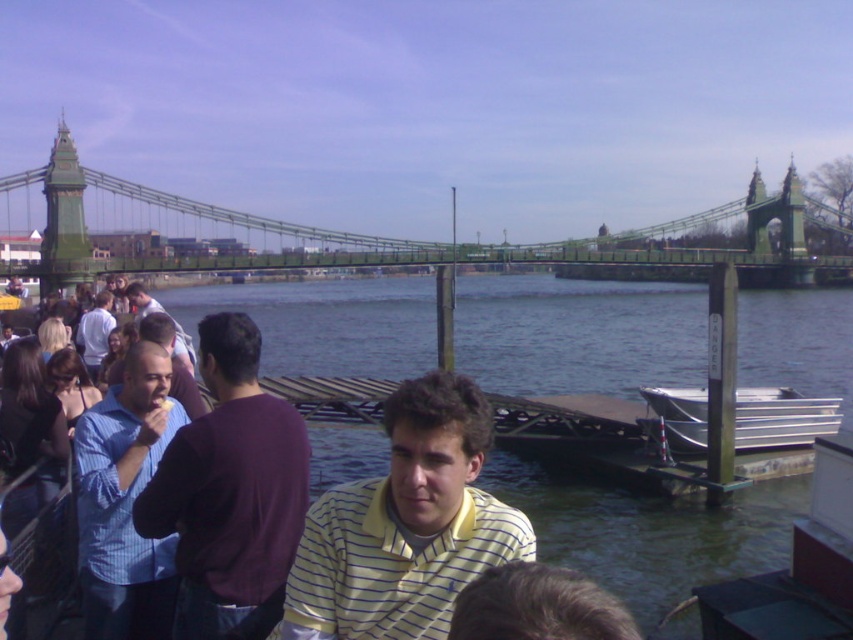
Question: Which of the following is the farthest from the observer?

Choices:
 (A) (801, 440)
 (B) (601, 625)
 (C) (181, 563)
 (D) (477, 454)

Answer: (A)

Question: Which of the following is the closest to the observer?

Choices:
 (A) (492, 625)
 (B) (682, 412)
 (C) (508, 250)
 (D) (140, 355)

Answer: (A)

Question: Does yellow striped shirt at center appear under green metal suspension bridge at upper center?

Choices:
 (A) yes
 (B) no

Answer: (A)

Question: Is green metal suspension bridge at upper center behind dark brown hair at lower center?

Choices:
 (A) yes
 (B) no

Answer: (A)

Question: Which is farther from the blue striped shirt at left?

Choices:
 (A) yellow striped shirt at center
 (B) metallic silver boat at lower right

Answer: (B)

Question: From the image, what is the correct spatial relationship of yellow striped shirt at center in relation to metallic silver boat at lower right?

Choices:
 (A) right
 (B) left

Answer: (B)